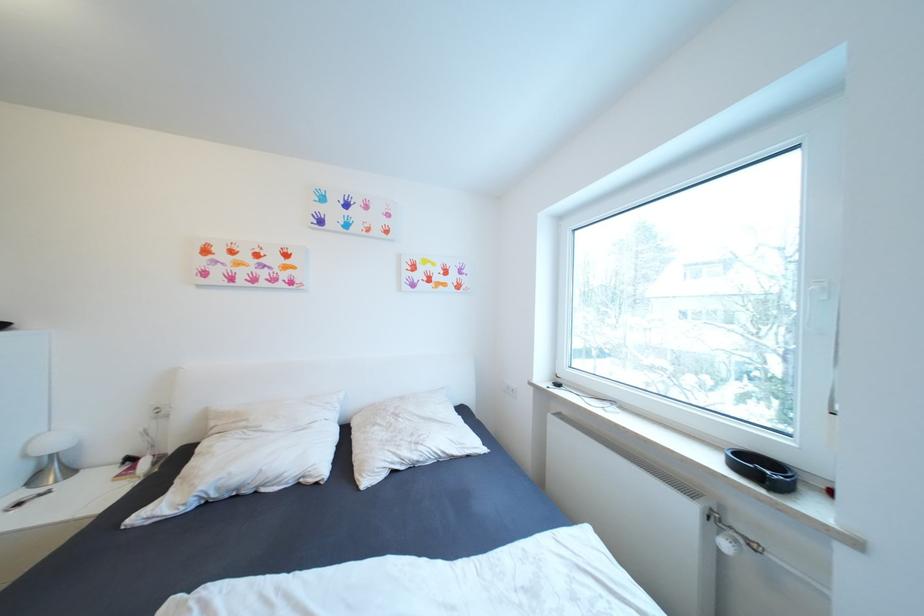
Where is `white window handle`? white window handle is located at coordinates (834, 363).